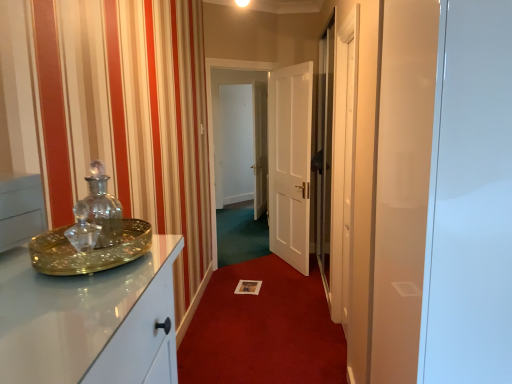
I want to click on blank space situated above white paper at center (from a real-world perspective), so click(270, 311).